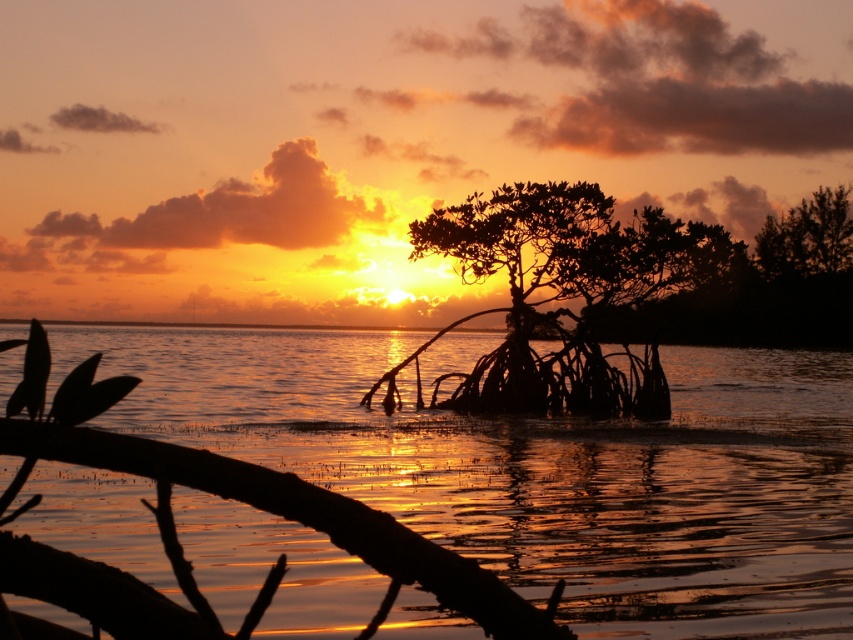
Is the position of glistening water at center less distant than that of silhouette wood at center?

Yes, it is.

Does glistening water at center have a lesser width compared to silhouette wood at center?

No.

The image size is (853, 640). Describe the element at coordinates (541, 468) in the screenshot. I see `glistening water at center` at that location.

Identify the location of glistening water at center. (541, 468).